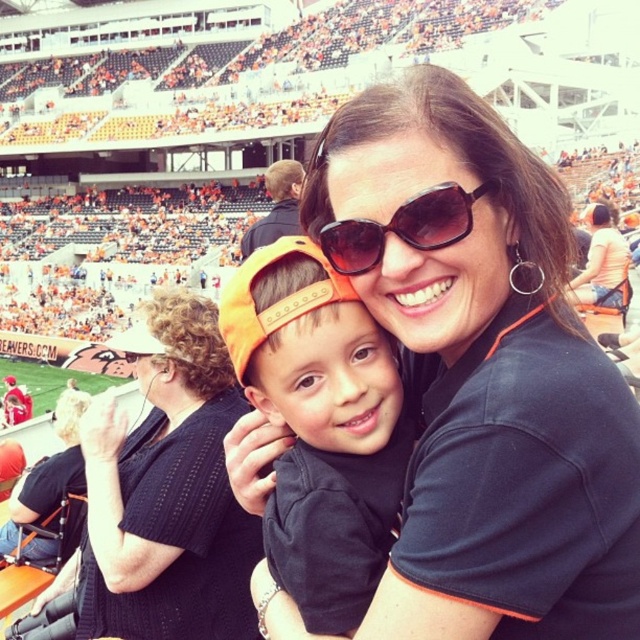
Question: Which is nearer to the black fabric shirt at center?

Choices:
 (A) orange fabric cap at center
 (B) black knit sweater at upper left

Answer: (A)

Question: Can you confirm if orange fabric cap at center is bigger than black plastic sunglasses at center?

Choices:
 (A) yes
 (B) no

Answer: (A)

Question: Which point is closer to the camera?

Choices:
 (A) (236, 628)
 (B) (465, 227)
 (C) (392, 448)
 (D) (520, 582)

Answer: (D)

Question: Is the position of orange fabric cap at center less distant than that of black plastic sunglasses at center?

Choices:
 (A) yes
 (B) no

Answer: (A)

Question: Among these objects, which one is nearest to the camera?

Choices:
 (A) black knit sweater at upper left
 (B) black plastic sunglasses at center
 (C) orange fabric cap at center

Answer: (C)

Question: Can you confirm if black fabric shirt at center is bigger than orange fabric cap at center?

Choices:
 (A) yes
 (B) no

Answer: (A)